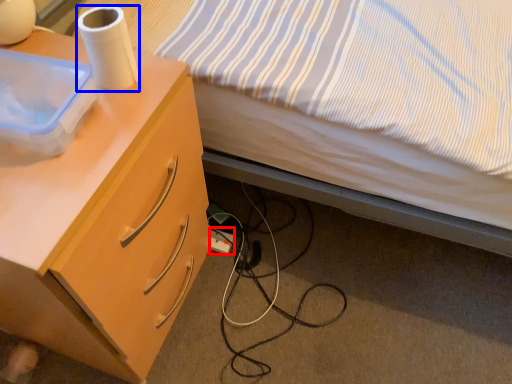
Question: Which object is closer to the camera taking this photo, power outlet (highlighted by a red box) or paper towel (highlighted by a blue box)?

Choices:
 (A) power outlet
 (B) paper towel

Answer: (B)